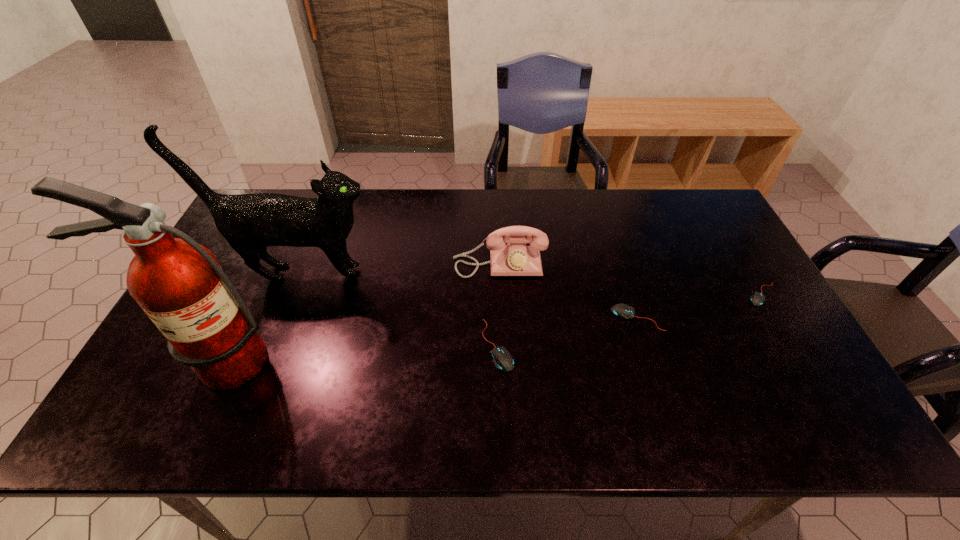
Identify the location of free space located 0.350m on the back of the rightmost mouse. (712, 208).

This screenshot has width=960, height=540. What are the coordinates of `vacant space located on the face of the cat` in the screenshot? It's located at (498, 273).

Locate an element on the screen. This screenshot has height=540, width=960. blank area located on the dial of the fourth shortest object is located at coordinates (505, 386).

At what (x,y) coordinates should I click in order to perform the action: click on mouse at the near edge. Please return your answer as a coordinate pair (x, y). This screenshot has height=540, width=960. Looking at the image, I should click on (503, 360).

Find the location of `fire extinguisher located at the near edge`. fire extinguisher located at the near edge is located at coordinates (179, 284).

What are the coordinates of `cat positioned at the left edge` in the screenshot? It's located at point(249,222).

Image resolution: width=960 pixels, height=540 pixels. Find the location of `fire extinguisher located at the left edge`. fire extinguisher located at the left edge is located at coordinates (179, 284).

This screenshot has width=960, height=540. I want to click on object located at the right edge, so click(757, 299).

I want to click on object present at the near left corner, so click(179, 284).

The height and width of the screenshot is (540, 960). In the image, there is a desktop. In order to click on vacant area at the far edge in this screenshot , I will do `click(455, 190)`.